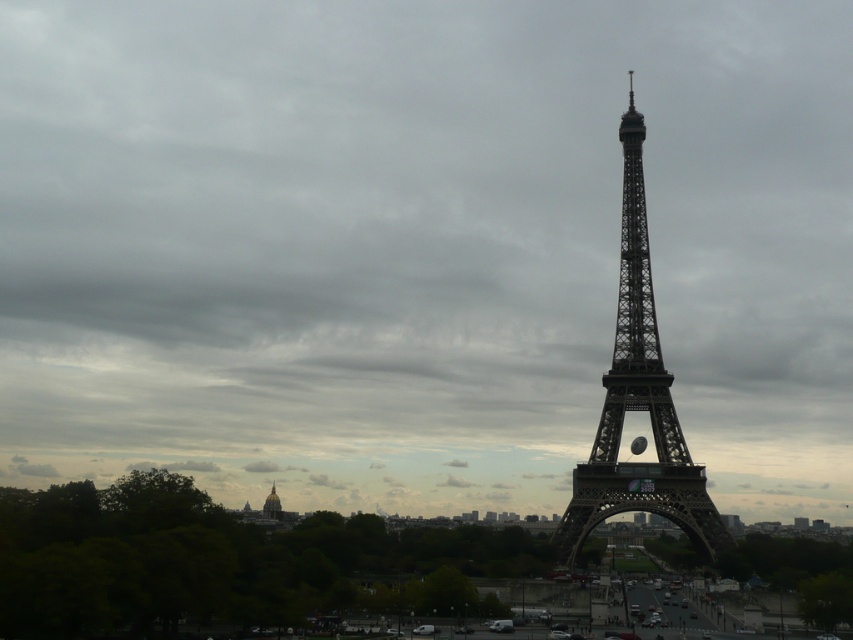
Between metallic structure at center and golden dome building at lower center, which one appears on the right side from the viewer's perspective?

metallic structure at center is more to the right.

Which is above, metallic structure at center or golden dome building at lower center?

Positioned higher is metallic structure at center.

Image resolution: width=853 pixels, height=640 pixels. What do you see at coordinates (637, 401) in the screenshot?
I see `metallic structure at center` at bounding box center [637, 401].

The height and width of the screenshot is (640, 853). Identify the location of metallic structure at center. (637, 401).